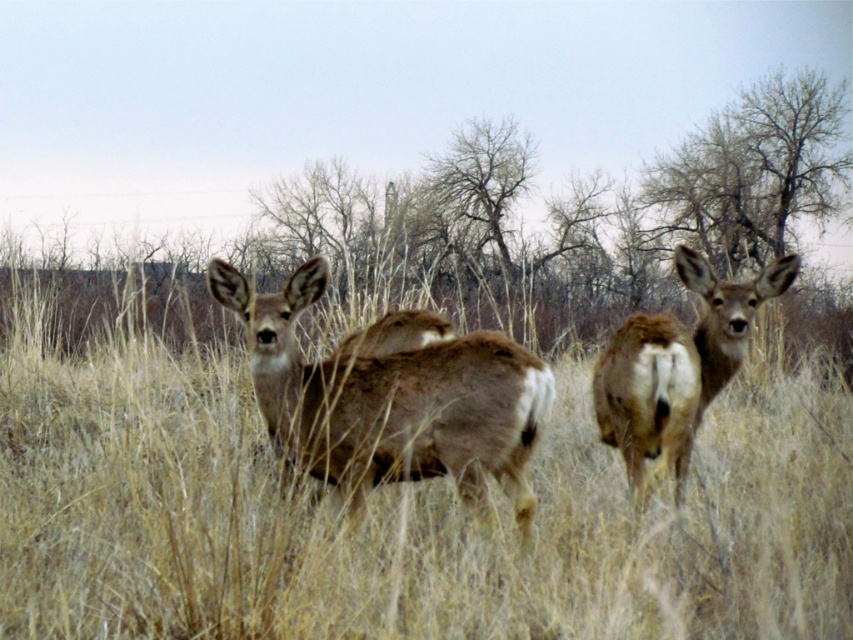
You are a photographer trying to capture the two deer in the scene. Since the brown textured grass at center and the brown furry deer at center are both at the center, which one is more in the foreground?

The brown textured grass at center occupies less space than the brown furry deer at center, so the brown furry deer at center is more in the foreground.

You are a wildlife photographer aiming to capture both deer in a single frame. Given their positions, which deer would you need to adjust your camera angle to include first, the brown fur deer at center or the brown furry deer at center?

The brown fur deer at center is wider than the brown furry deer at center, so you should adjust your camera angle to include the brown fur deer at center first to ensure both fit in the frame.

You are a photographer aiming to capture the brown textured grass at center in your shot. Based on its 2D coordinates, where should you position your camera to ensure it is centered in the frame?

To center the brown textured grass at center in your shot, position your camera so that it aligns with the coordinates point (403, 520).